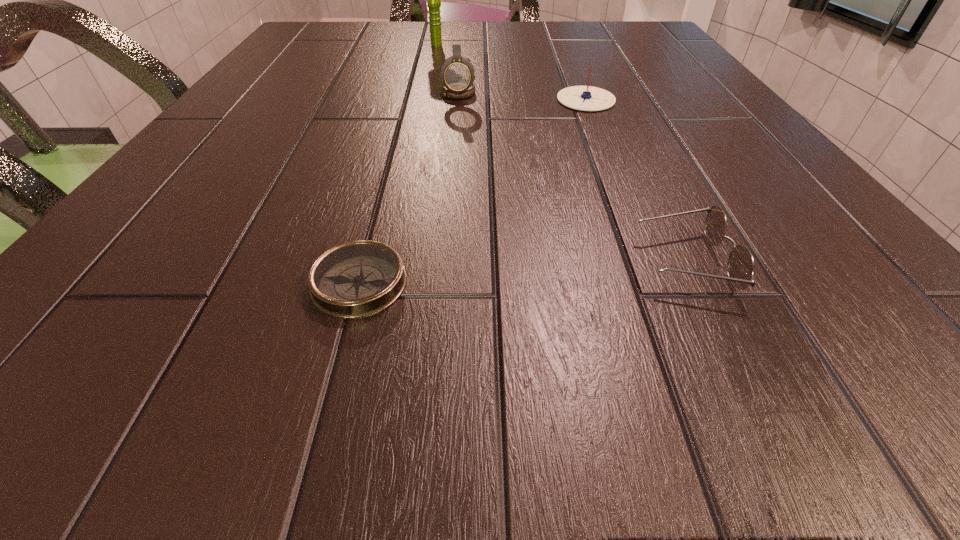
Find the location of a particular element. This screenshot has width=960, height=540. free space at the left edge of the desktop is located at coordinates (268, 82).

Identify the location of vacant space at the right edge of the desktop. (876, 262).

In the image, there is a desktop. Where is `free space at the far left corner`? This screenshot has width=960, height=540. free space at the far left corner is located at coordinates (339, 25).

This screenshot has width=960, height=540. I want to click on free region at the far right corner of the desktop, so click(640, 30).

Find the location of a particular element. The width and height of the screenshot is (960, 540). free region at the near right corner of the desktop is located at coordinates (804, 384).

At what (x,y) coordinates should I click in order to perform the action: click on vacant area between the second shortest object and the second tallest compass. Please return your answer as a coordinate pair (x, y). This screenshot has height=540, width=960. Looking at the image, I should click on (635, 180).

The height and width of the screenshot is (540, 960). What are the coordinates of `unoccupied area between the second shortest object and the third shortest object` in the screenshot? It's located at (635, 180).

Where is `vacant region between the fourth tallest object and the rightmost compass`? vacant region between the fourth tallest object and the rightmost compass is located at coordinates (635, 180).

At what (x,y) coordinates should I click in order to perform the action: click on vacant space that's between the nearest compass and the second shortest object. Please return your answer as a coordinate pair (x, y). The height and width of the screenshot is (540, 960). Looking at the image, I should click on (521, 272).

You are a GUI agent. You are given a task and a screenshot of the screen. Output one action in this format:
    pyautogui.click(x=<x>, y=<y>)
    Task: Click on the vacant space that is in between the nearest compass and the third object from left to right
    
    Given the screenshot: What is the action you would take?
    pyautogui.click(x=409, y=187)